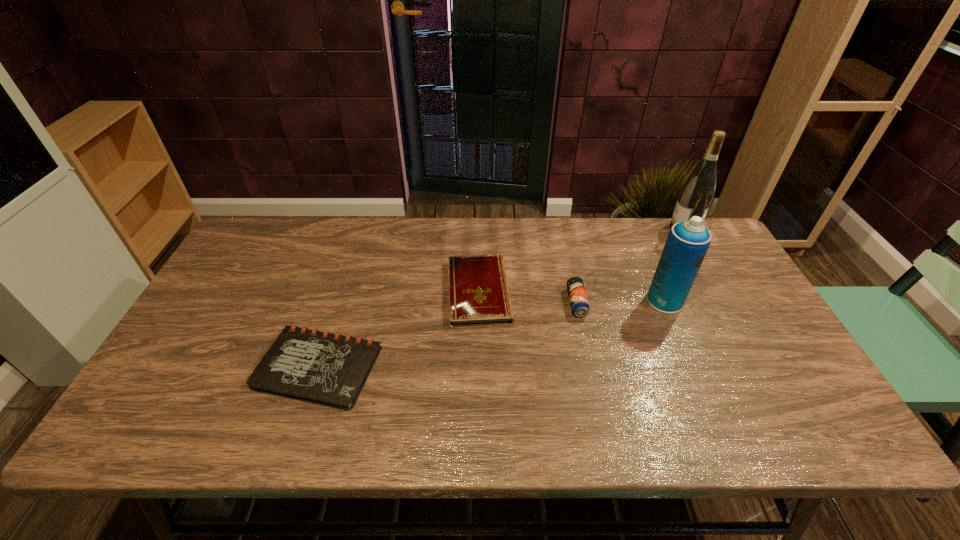
Locate an element on the screen. The image size is (960, 540). object at the right edge is located at coordinates click(x=696, y=195).

Where is `object situated at the far right corner`? This screenshot has width=960, height=540. object situated at the far right corner is located at coordinates (696, 195).

Find the location of `free region at the far edge of the desktop`. free region at the far edge of the desktop is located at coordinates (655, 253).

Identify the location of vacant space at the left edge. (168, 383).

Image resolution: width=960 pixels, height=540 pixels. I want to click on blank space at the right edge of the desktop, so click(731, 350).

Locate an element on the screen. The image size is (960, 540). free space at the far left corner is located at coordinates (258, 263).

At what (x,y) coordinates should I click in order to perform the action: click on vacant area that lies between the right notebook and the third object from left to right. Please return your answer as a coordinate pair (x, y). Image resolution: width=960 pixels, height=540 pixels. Looking at the image, I should click on 528,297.

Where is `free space between the farther notebook and the third object from left to right`? free space between the farther notebook and the third object from left to right is located at coordinates (528, 297).

Where is `unoccupied area between the beer can and the farther notebook`? Image resolution: width=960 pixels, height=540 pixels. unoccupied area between the beer can and the farther notebook is located at coordinates (528, 297).

Locate an element on the screen. Image resolution: width=960 pixels, height=540 pixels. vacant space in between the third shortest object and the tallest object is located at coordinates (630, 265).